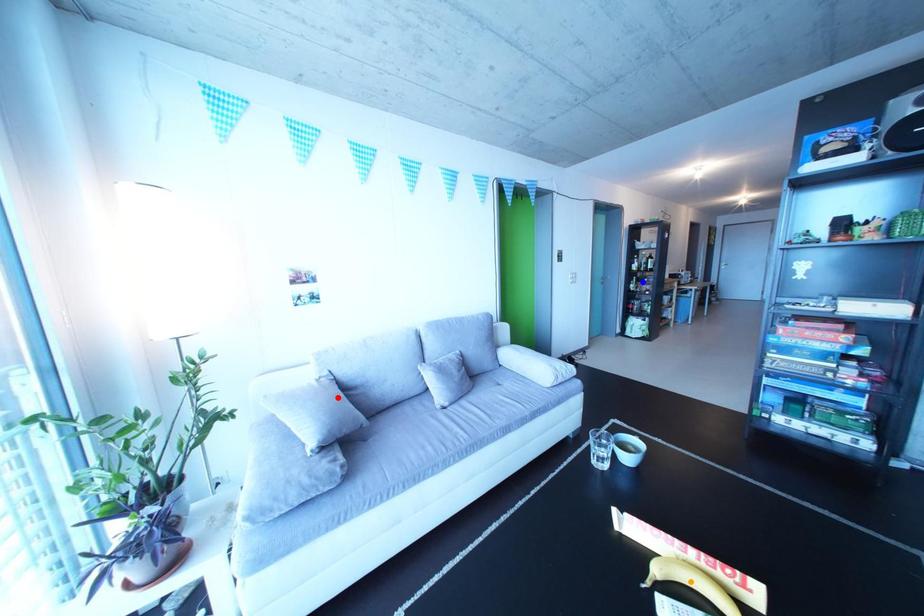
Order these from nearest to farthest:
- red point
- blue point
- orange point

blue point, red point, orange point